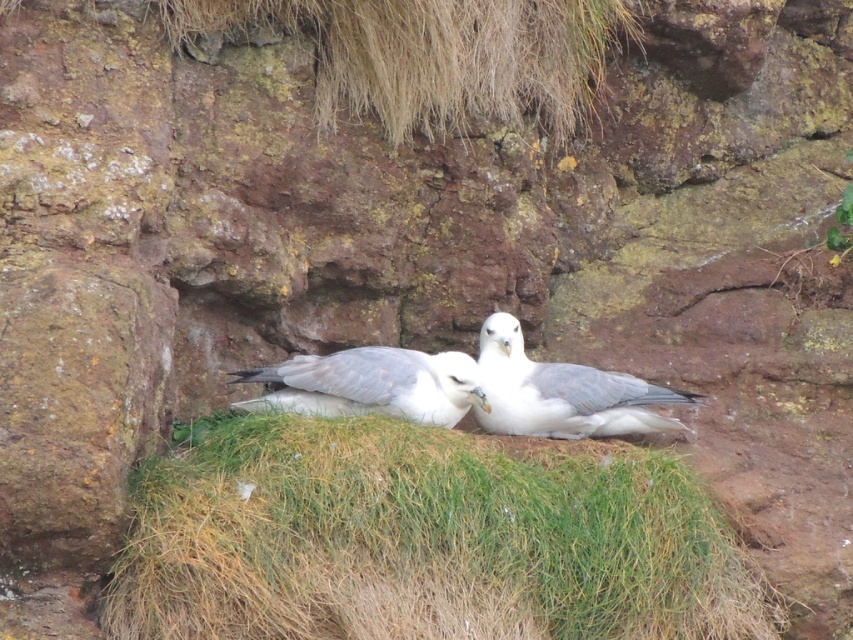
You are a birdwatcher observing the scene from a distance. You notice the green grass at center and the white feathered bird at center. Which object is closer to your viewpoint?

The green grass at center is in front of the white feathered bird at center, so the green grass at center is closer to your viewpoint.

You are standing in front of the two seagulls resting on the grassy patch within the rocky crevice. You notice two points marked on the image at coordinates point (338, 492) and point (488, 369). Which of these points is nearer to you?

Point (338, 492) is closer to the viewer than point (488, 369).

You are a birdwatcher trying to identify two birds in the image. You notice both are labeled as white matte bird at center and white feathered bird at center. Which of these two birds is smaller in width?

The white matte bird at center has a lesser width compared to the white feathered bird at center, so the white matte bird at center is smaller in width.